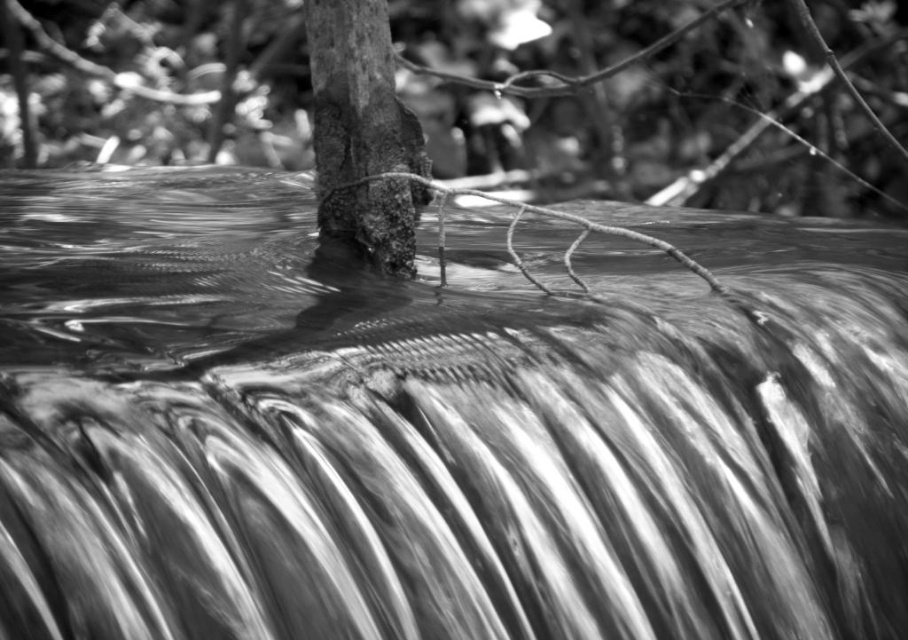
You are a photographer adjusting your camera settings to focus on two points in the scene. The first point is point (585, 244) and the second is point (383, 3). Which point should you focus on first if you want to ensure both are in focus?

You should focus on point (383, 3) first because it is closer to the camera than point (585, 244). By focusing on the closer point, the depth of field may extend to include the farther point as well.